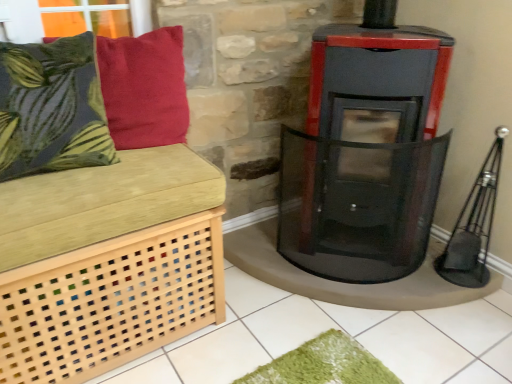
Question: From a real-world perspective, is green leafy fabric cushion at left, the 2th pillow viewed from the right, positioned under velvety red pillow at upper left, which is the second pillow from left to right, based on gravity?

Choices:
 (A) no
 (B) yes

Answer: (A)

Question: Considering the relative positions of green leafy fabric cushion at left, the 2th pillow viewed from the right, and velvety red pillow at upper left, which is the second pillow from left to right, in the image provided, is green leafy fabric cushion at left, the 2th pillow viewed from the right, in front of velvety red pillow at upper left, which is the second pillow from left to right,?

Choices:
 (A) no
 (B) yes

Answer: (B)

Question: Is green leafy fabric cushion at left, acting as the first pillow starting from the left, aimed at velvety red pillow at upper left, which is the second pillow from left to right?

Choices:
 (A) yes
 (B) no

Answer: (B)

Question: Does green leafy fabric cushion at left, acting as the first pillow starting from the left, have a smaller size compared to velvety red pillow at upper left, which appears as the first pillow when viewed from the right?

Choices:
 (A) yes
 (B) no

Answer: (B)

Question: Does green leafy fabric cushion at left, the 2th pillow viewed from the right, appear on the right side of velvety red pillow at upper left, which appears as the first pillow when viewed from the right?

Choices:
 (A) yes
 (B) no

Answer: (B)

Question: In the image, is velvety red pillow at upper left, which appears as the first pillow when viewed from the right, on the left side or the right side of green leafy fabric cushion at left, acting as the first pillow starting from the left?

Choices:
 (A) right
 (B) left

Answer: (A)

Question: In terms of size, does velvety red pillow at upper left, which appears as the first pillow when viewed from the right, appear bigger or smaller than green leafy fabric cushion at left, acting as the first pillow starting from the left?

Choices:
 (A) small
 (B) big

Answer: (A)

Question: In the image, is velvety red pillow at upper left, which is the second pillow from left to right, positioned in front of or behind green leafy fabric cushion at left, acting as the first pillow starting from the left?

Choices:
 (A) front
 (B) behind

Answer: (B)

Question: From the image's perspective, is velvety red pillow at upper left, which is the second pillow from left to right, above or below green leafy fabric cushion at left, the 2th pillow viewed from the right?

Choices:
 (A) below
 (B) above

Answer: (B)

Question: In terms of height, does black glass wood burning stove at center look taller or shorter compared to green leafy fabric cushion at left, the 2th pillow viewed from the right?

Choices:
 (A) tall
 (B) short

Answer: (A)

Question: Is black glass wood burning stove at center in front of or behind green leafy fabric cushion at left, the 2th pillow viewed from the right, in the image?

Choices:
 (A) behind
 (B) front

Answer: (A)

Question: Would you say black glass wood burning stove at center is to the left or to the right of green leafy fabric cushion at left, the 2th pillow viewed from the right, in the picture?

Choices:
 (A) left
 (B) right

Answer: (B)

Question: Considering the positions of black glass wood burning stove at center and green leafy fabric cushion at left, the 2th pillow viewed from the right, in the image, is black glass wood burning stove at center wider or thinner than green leafy fabric cushion at left, the 2th pillow viewed from the right,?

Choices:
 (A) thin
 (B) wide

Answer: (B)

Question: Relative to light wood lattice bench at left, is black glass wood burning stove at center in front or behind?

Choices:
 (A) front
 (B) behind

Answer: (B)

Question: From a real-world perspective, is black glass wood burning stove at center above or below light wood lattice bench at left?

Choices:
 (A) below
 (B) above

Answer: (B)